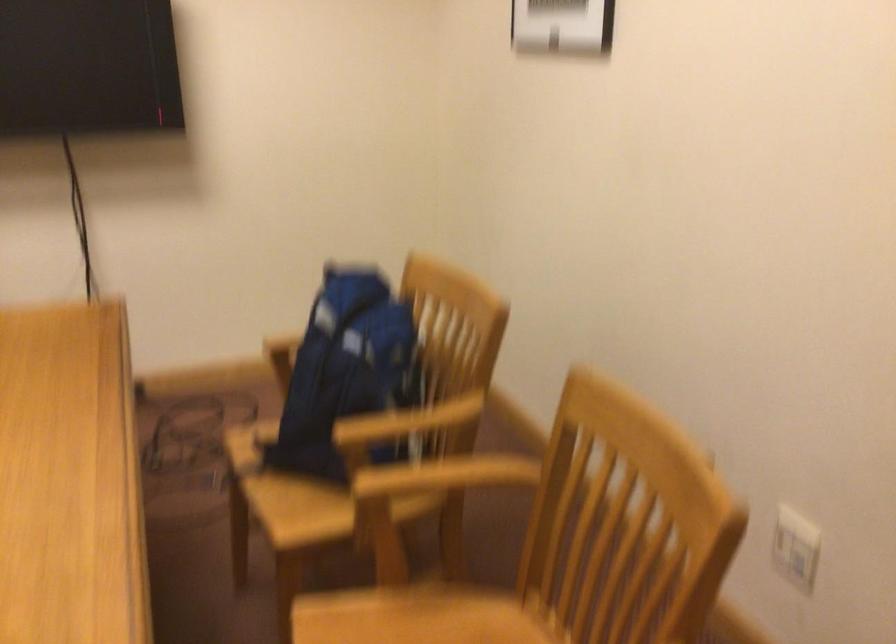
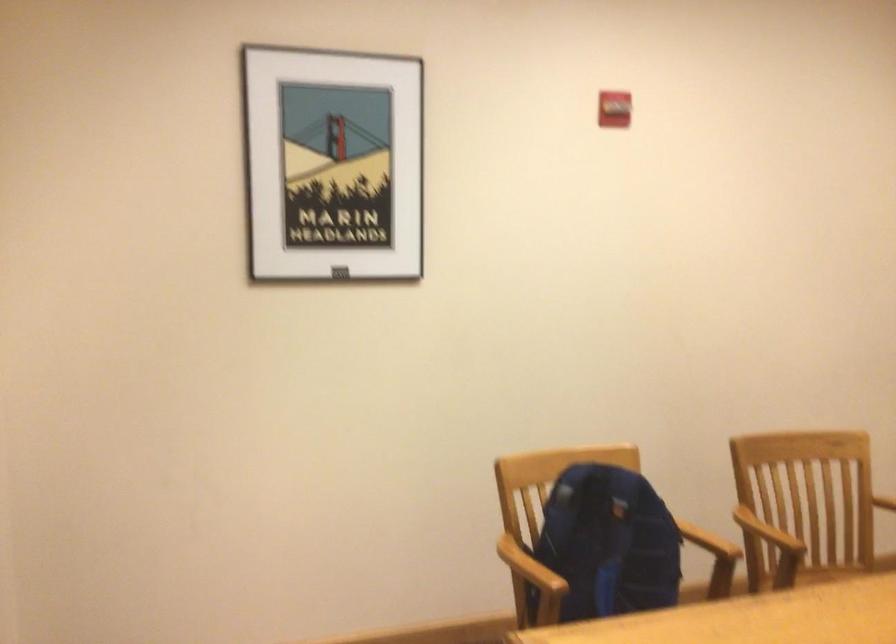
Locate, in the second image, the point that corresponds to the point at 425,471 in the first image.

(767, 532)